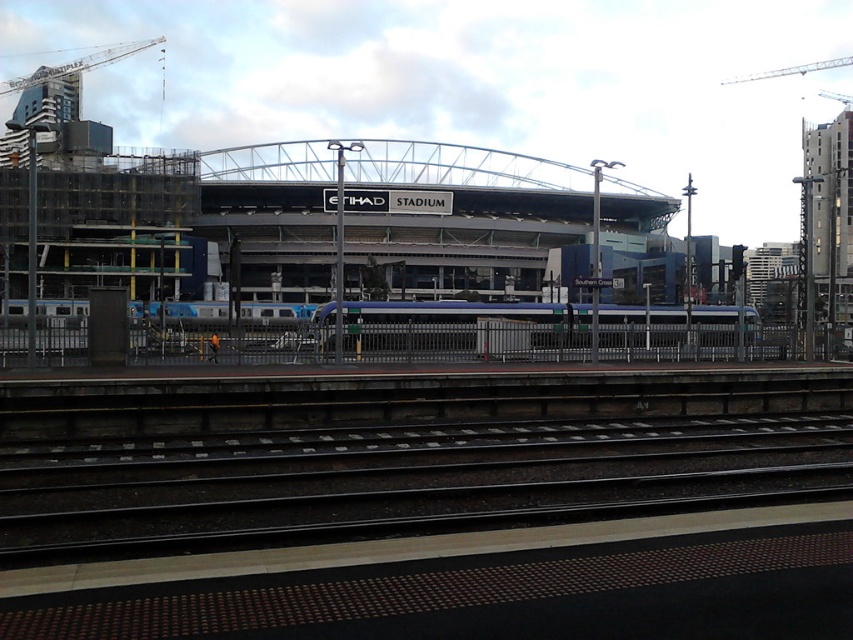
Question: Which of these objects is positioned farthest from the black asphalt train track at center?

Choices:
 (A) metallic gray crane at upper left
 (B) blue metallic train at center

Answer: (A)

Question: Can you confirm if black asphalt train track at center is positioned to the left of blue metallic train at center?

Choices:
 (A) no
 (B) yes

Answer: (B)

Question: Does blue metallic train at center appear under metallic gray crane at upper left?

Choices:
 (A) no
 (B) yes

Answer: (B)

Question: Which object appears farthest from the camera in this image?

Choices:
 (A) black asphalt train track at center
 (B) metallic gray crane at upper left
 (C) blue metallic train at center

Answer: (B)

Question: Which point appears farthest from the camera in this image?

Choices:
 (A) (663, 326)
 (B) (711, 438)
 (C) (4, 90)

Answer: (C)

Question: Is black asphalt train track at center to the left of metallic gray crane at upper left from the viewer's perspective?

Choices:
 (A) yes
 (B) no

Answer: (B)